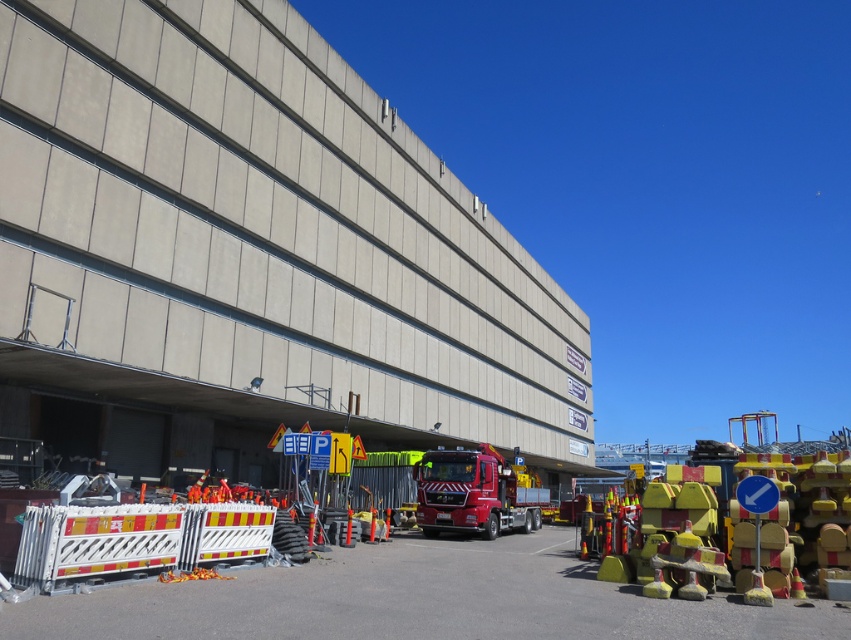
How much distance is there between concrete building at center and white plastic barricade at lower left?

19.72 meters

Can you confirm if concrete building at center is wider than white plastic barricade at lower left?

Indeed, concrete building at center has a greater width compared to white plastic barricade at lower left.

Does point (93, 296) come closer to viewer compared to point (124, 529)?

No.

I want to click on concrete building at center, so click(x=250, y=256).

Is white plastic barricade at lower left bigger than shiny red fire truck at center?

Actually, white plastic barricade at lower left might be smaller than shiny red fire truck at center.

Who is taller, white plastic barricade at lower left or shiny red fire truck at center?

Standing taller between the two is shiny red fire truck at center.

Is point (266, 536) in front of point (455, 531)?

Yes, it is.

Identify the location of white plastic barricade at lower left. The image size is (851, 640). (136, 538).

Can you confirm if yellow rubber cones at lower right is bigger than shiny red fire truck at center?

Indeed, yellow rubber cones at lower right has a larger size compared to shiny red fire truck at center.

Can you confirm if yellow rubber cones at lower right is positioned above shiny red fire truck at center?

Correct, yellow rubber cones at lower right is located above shiny red fire truck at center.

The image size is (851, 640). What do you see at coordinates (418, 600) in the screenshot?
I see `yellow rubber cones at lower right` at bounding box center [418, 600].

This screenshot has height=640, width=851. In order to click on yellow rubber cones at lower right in this screenshot , I will do `click(418, 600)`.